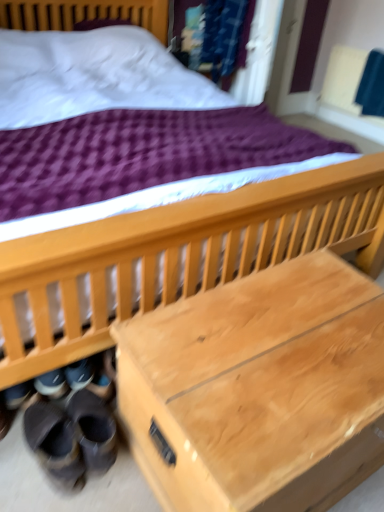
Question: Is leather brown shoes at lower left taller or shorter than natural wood trunk at lower center?

Choices:
 (A) tall
 (B) short

Answer: (B)

Question: Looking at their shapes, would you say leather brown shoes at lower left is wider or thinner than natural wood trunk at lower center?

Choices:
 (A) wide
 (B) thin

Answer: (B)

Question: Which is farther from the leather-like brown shoes at lower left, which is the first footwear in left-to-right order?

Choices:
 (A) natural wood trunk at lower center
 (B) leather brown shoes at lower left
 (C) black suede shoes at lower left, arranged as the 2th footwear when viewed from the left

Answer: (A)

Question: Estimate the real-world distances between objects in this image. Which object is farther from the black suede shoes at lower left, the first footwear from the right?

Choices:
 (A) natural wood trunk at lower center
 (B) leather-like brown shoes at lower left, which ranks as the 2th footwear in right-to-left order
 (C) leather brown shoes at lower left

Answer: (A)